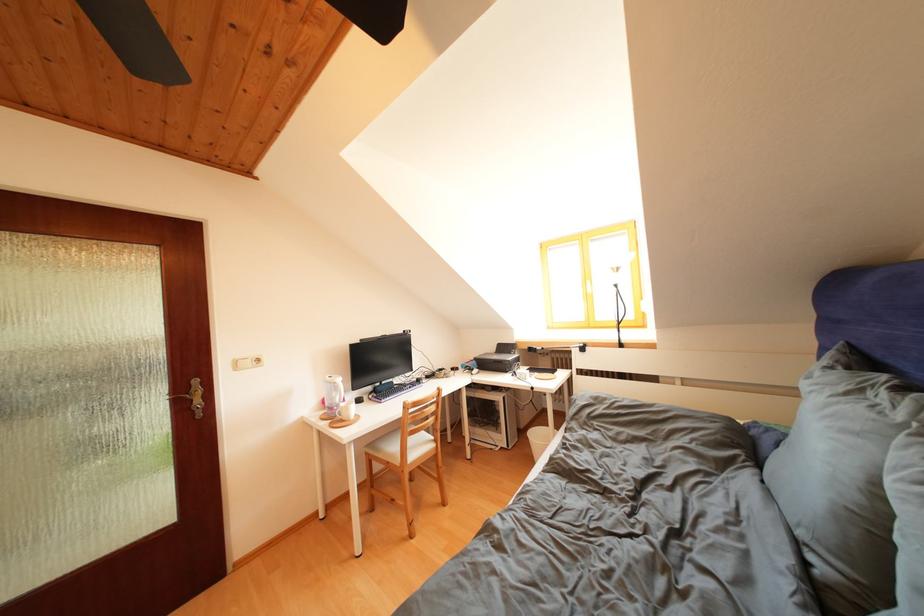
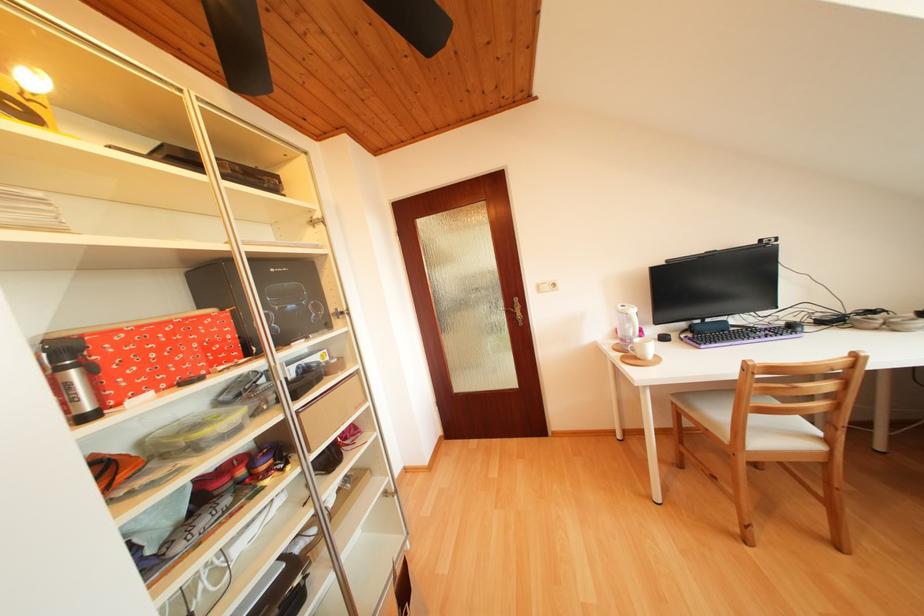
Locate, in the second image, the point that corresponds to point 355,413 in the first image.

(650, 350)